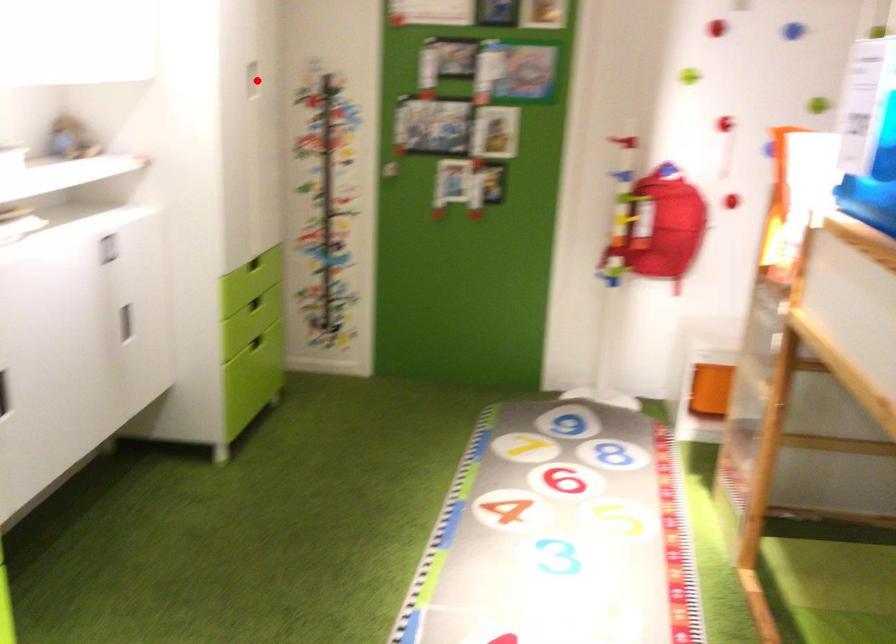
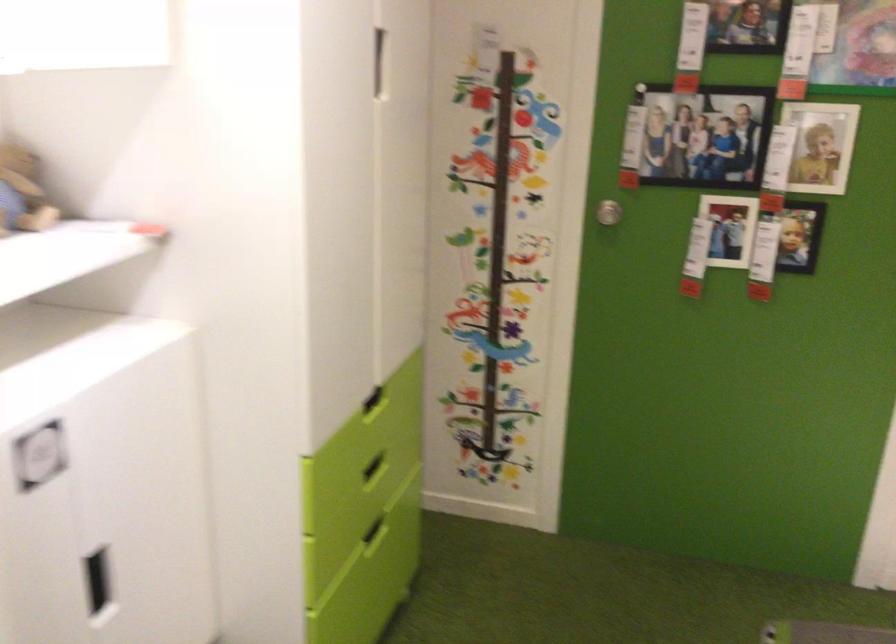
Question: I am providing you with two images of the same scene from different viewpoints. A red point is marked on the first image. At the location where the point appears in image 1, is it still visible in image 2?

Choices:
 (A) Yes
 (B) No

Answer: (A)